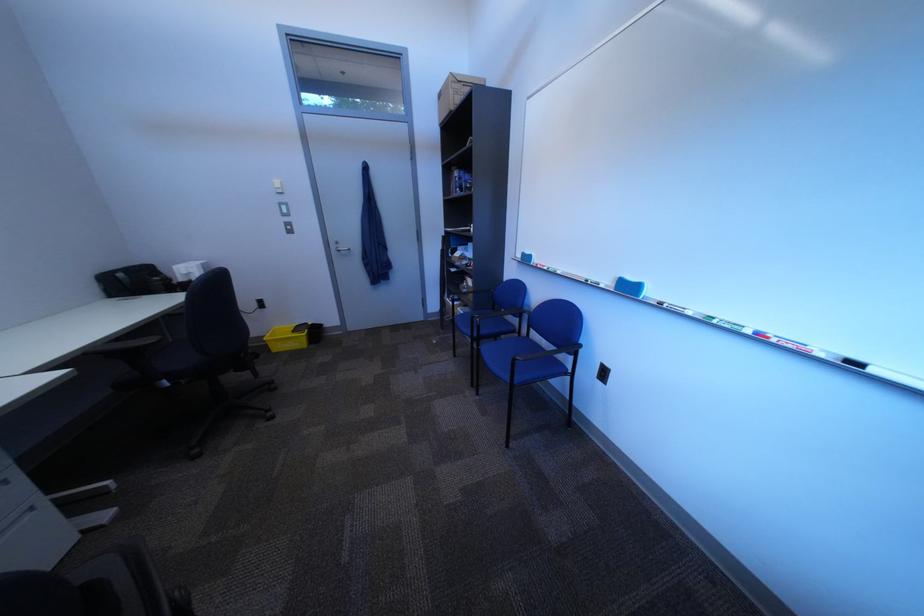
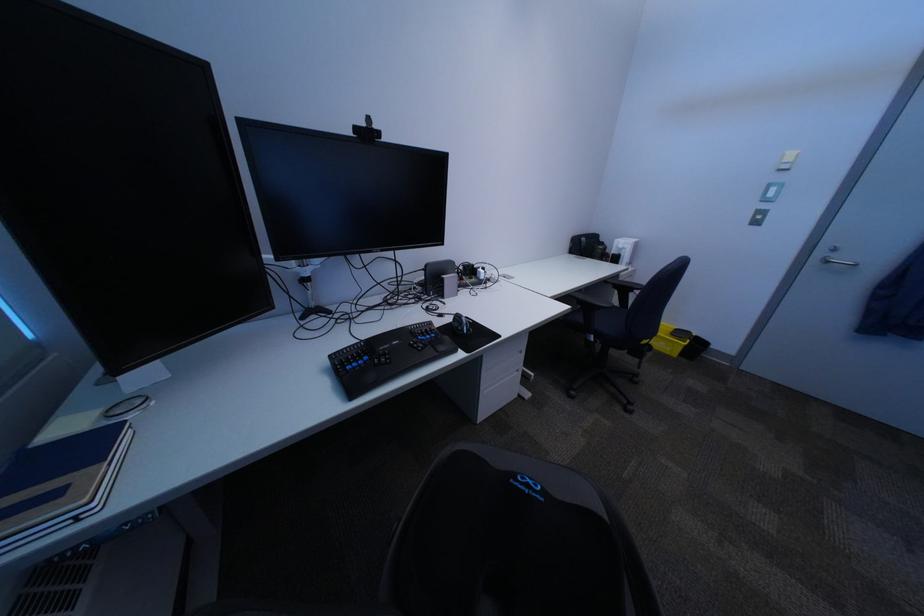
Find the pixel in the second image that matches (296,188) in the first image.

(807, 163)